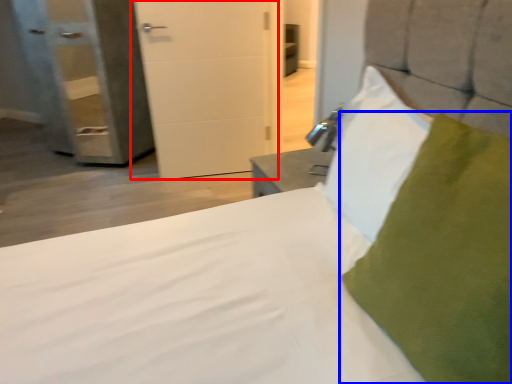
Question: Which object appears farthest to the camera in this image, door (highlighted by a red box) or pillow (highlighted by a blue box)?

Choices:
 (A) door
 (B) pillow

Answer: (A)